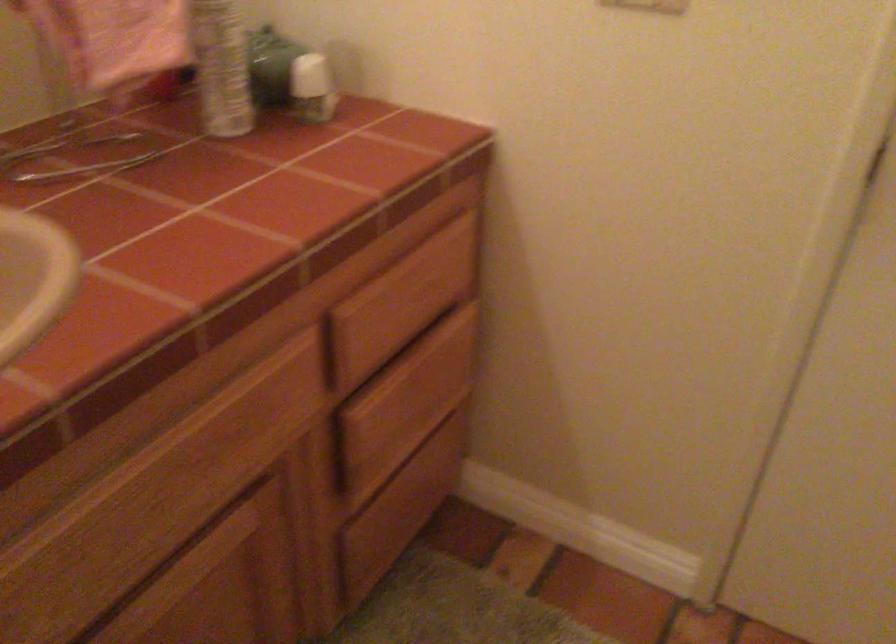
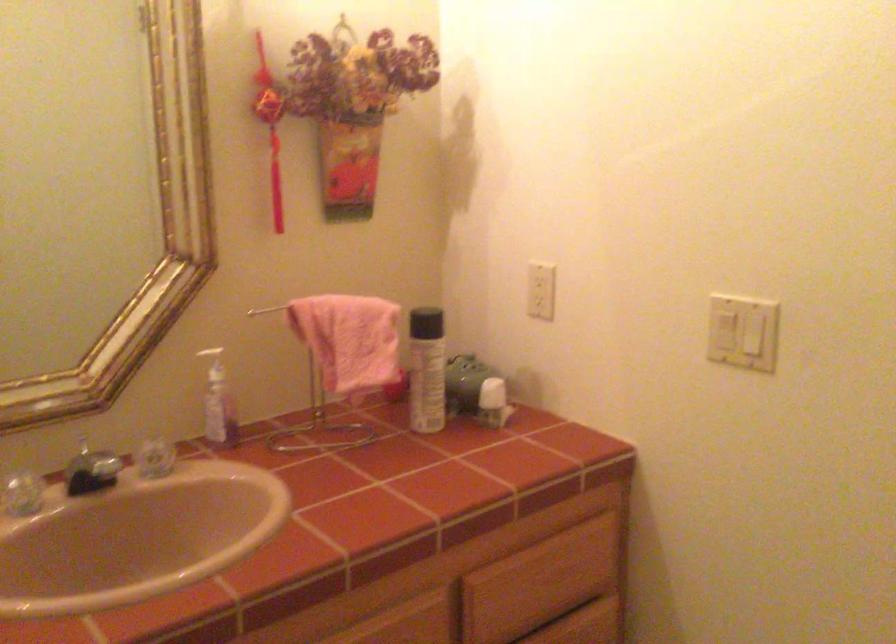
Which direction would the cameraman need to move to produce the second image?

The cameraman walked toward right, backward.